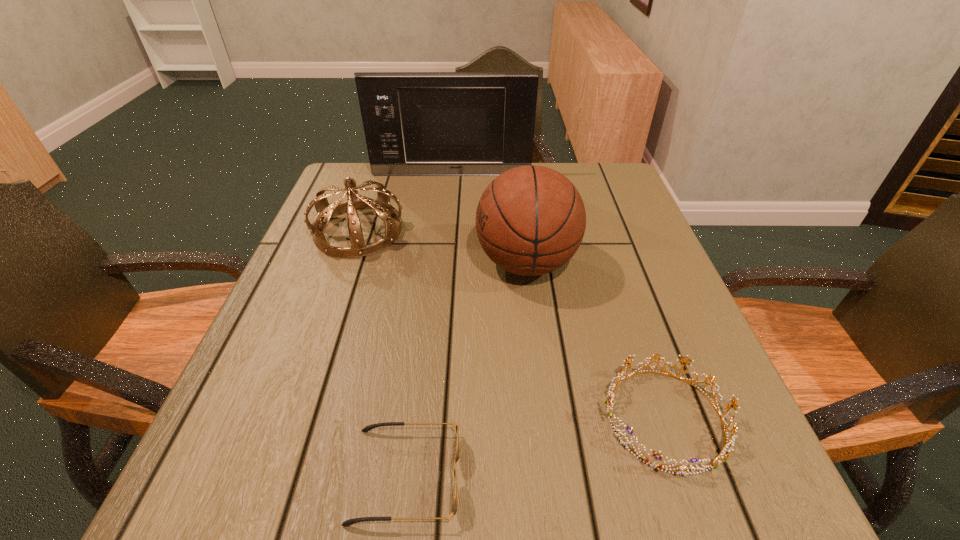
Locate an element on the screen. The image size is (960, 540). vacant space at the right edge is located at coordinates (600, 240).

This screenshot has height=540, width=960. In order to click on vacant region at the far left corner of the desktop in this screenshot , I will do `click(348, 170)`.

The height and width of the screenshot is (540, 960). I want to click on free location at the near left corner, so click(267, 477).

This screenshot has width=960, height=540. What are the coordinates of `free space at the far right corner of the desktop` in the screenshot? It's located at (611, 176).

The width and height of the screenshot is (960, 540). In order to click on vacant area between the fourth tallest object and the farther tiara in this screenshot , I will do `click(512, 325)`.

Locate an element on the screen. free space that is in between the basketball and the shortest object is located at coordinates (466, 369).

This screenshot has height=540, width=960. I want to click on unoccupied area between the left tiara and the tallest object, so click(x=405, y=203).

At what (x,y) coordinates should I click in order to perform the action: click on vacant space in between the sunglasses and the taller tiara. Please return your answer as a coordinate pair (x, y). Looking at the image, I should click on (382, 353).

The image size is (960, 540). Identify the location of vacant space that's between the third tallest object and the shortest object. (382, 353).

Identify the location of empty space between the shorter tiara and the third tallest object. This screenshot has height=540, width=960. (512, 325).